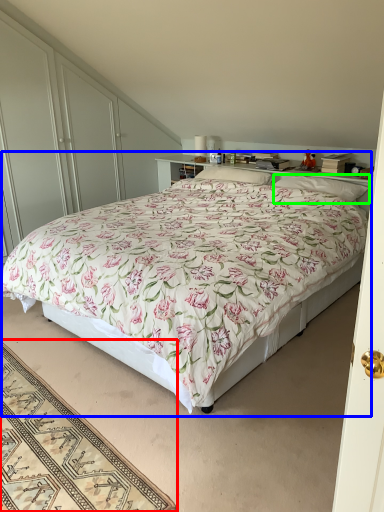
Question: Which object is the farthest from mat (highlighted by a red box)? Choose among these: bed (highlighted by a blue box) or pillow (highlighted by a green box).

Choices:
 (A) bed
 (B) pillow

Answer: (B)